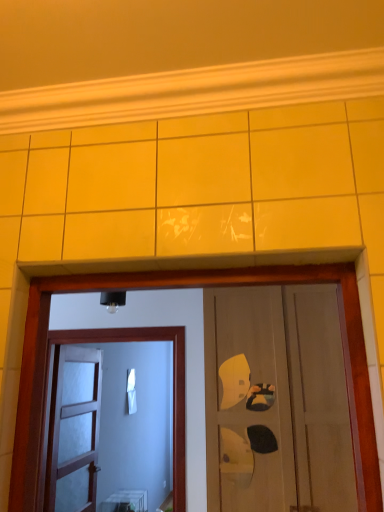
Question: Do you think matte wooden door at center, the third door viewed from the left, is within translucent glass door at center, which appears as the third door when viewed from the right, or outside of it?

Choices:
 (A) inside
 (B) outside

Answer: (B)

Question: From the image's perspective, is matte wooden door at center, which appears as the 1th door when viewed from the right, located above or below translucent glass door at center, the first door from the left?

Choices:
 (A) below
 (B) above

Answer: (B)

Question: Which is farther from the matte wooden door at center, the third door viewed from the left?

Choices:
 (A) matte wooden door at center, arranged as the 2th door when viewed from the right
 (B) translucent glass door at center, which appears as the third door when viewed from the right

Answer: (B)

Question: Which object is positioned farthest from the matte wooden door at center, the third door viewed from the left?

Choices:
 (A) matte wooden door at center, marked as the second door in a left-to-right arrangement
 (B) translucent glass door at center, the first door from the left

Answer: (B)